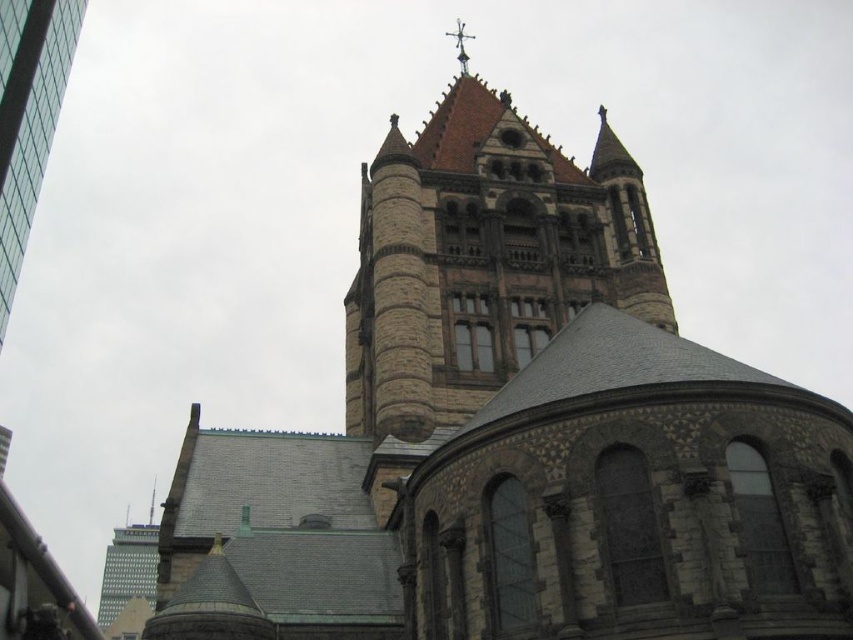
You are an architect evaluating the spatial relationship between the brown stone tower at upper center and the glassy steel skyscraper at upper left in the image. Which structure is located to the right of the other?

The brown stone tower at upper center is positioned on the right side of the glassy steel skyscraper at upper left.

You are an architect evaluating the skyline of a city. You notice two skyscrapers in the image. Which one is taller between the glassy steel skyscraper at upper left and the gray concrete skyscraper at lower left?

→ The glassy steel skyscraper at upper left is taller than the gray concrete skyscraper at lower left according to the description.

You are standing in front of the historic church and want to locate the point marked at coordinates point (483, 257). Based on the description, where would this point be located on the church?

The point (483, 257) is located on the brown stone tower at upper center.